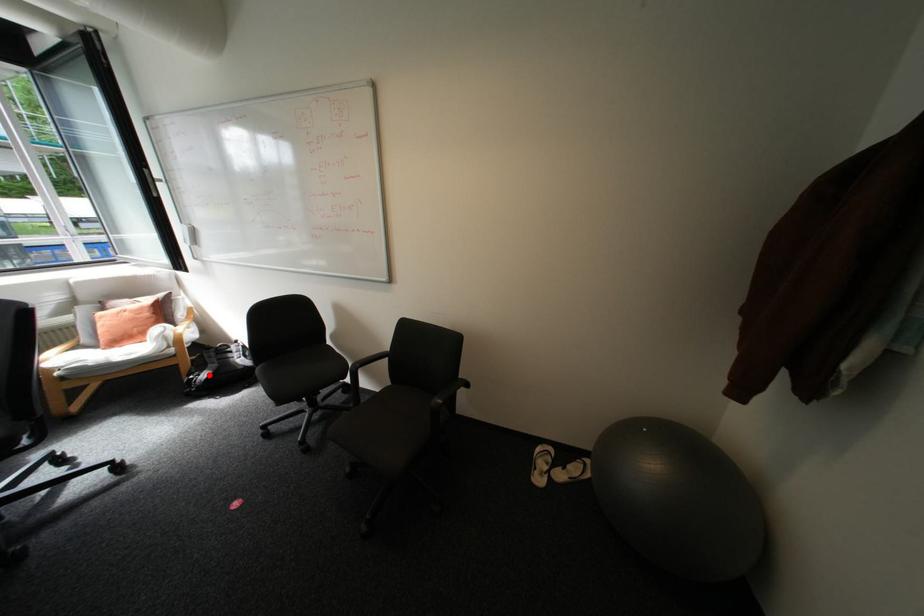
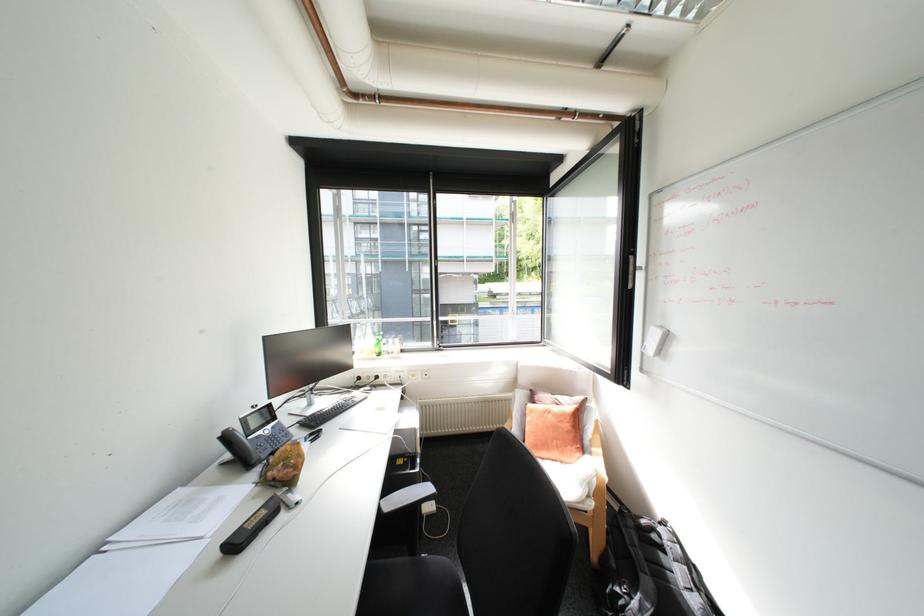
The point at the highlighted location is marked in the first image. Where is the corresponding point in the second image?

(640, 598)